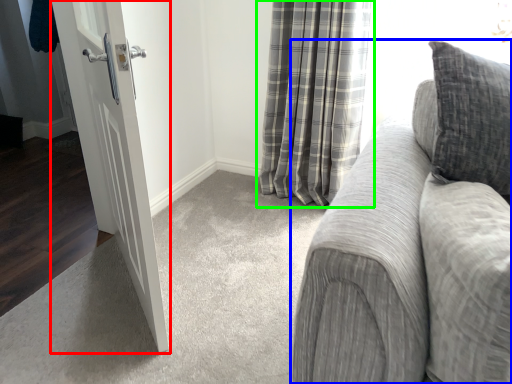
Question: Estimate the real-world distances between objects in this image. Which object is closer to door (highlighted by a red box), studio couch (highlighted by a blue box) or curtain (highlighted by a green box)?

Choices:
 (A) studio couch
 (B) curtain

Answer: (A)